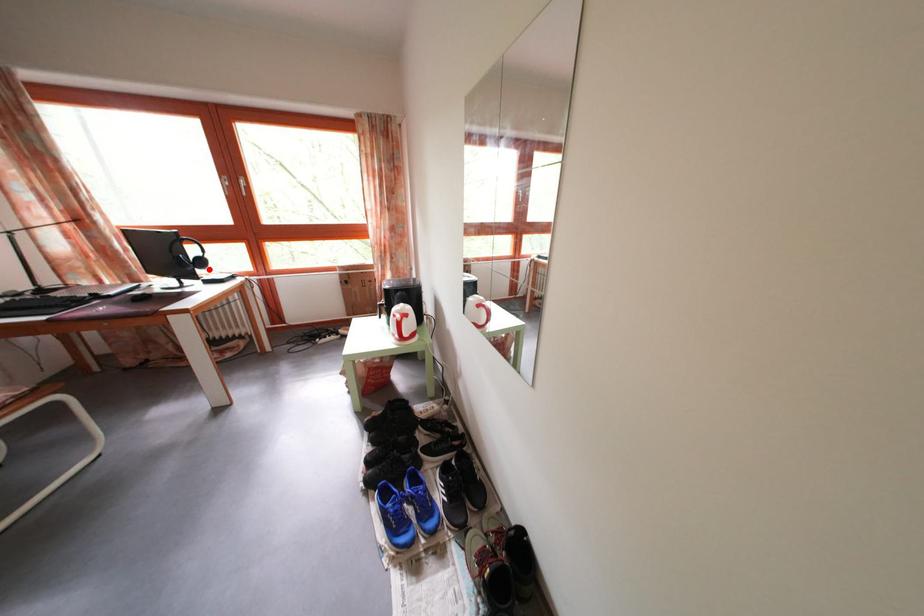
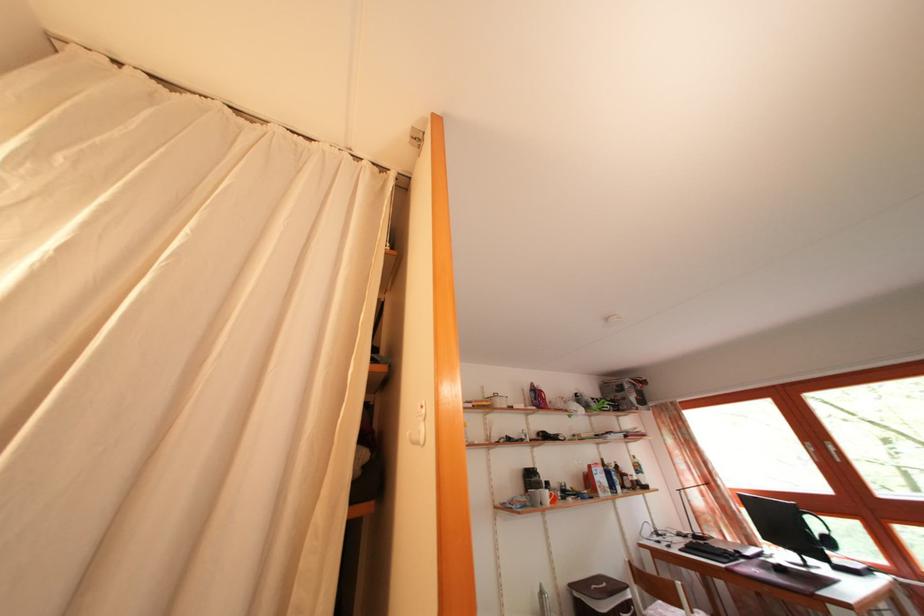
Question: I am providing you with two images of the same scene from different viewpoints. A red point is shown in image1. For the corresponding object point in image2, is it positioned nearer or farther from the camera?

Choices:
 (A) Nearer
 (B) Farther

Answer: (A)